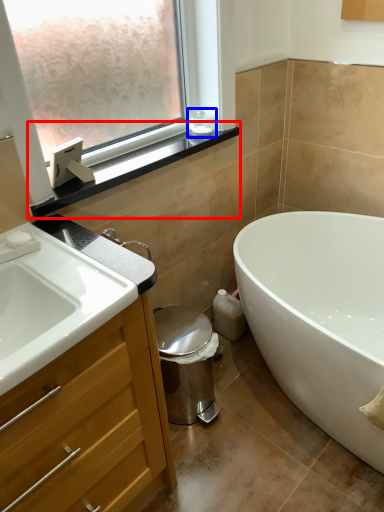
Question: Among these objects, which one is farthest to the camera, window sill (highlighted by a red box) or toiletry (highlighted by a blue box)?

Choices:
 (A) window sill
 (B) toiletry

Answer: (B)